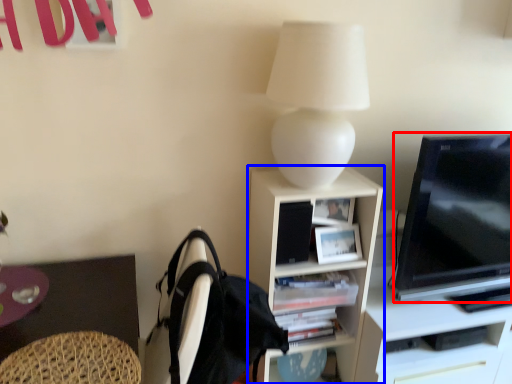
Question: Which of the following is the closest to the observer, television (highlighted by a red box) or shelf (highlighted by a blue box)?

Choices:
 (A) television
 (B) shelf

Answer: (A)